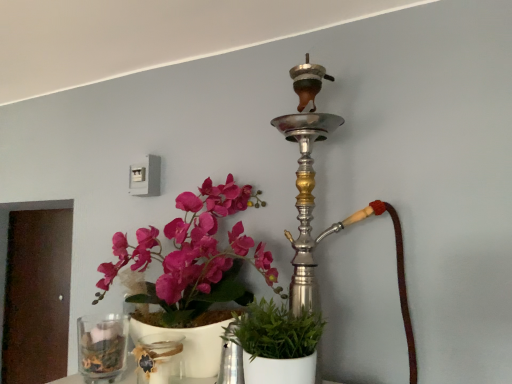
Describe the element at coordinates (276, 343) in the screenshot. Image resolution: width=512 pixels, height=384 pixels. I see `green matte plant at center` at that location.

The width and height of the screenshot is (512, 384). What do you see at coordinates (158, 358) in the screenshot?
I see `transparent glass jar at lower center` at bounding box center [158, 358].

This screenshot has width=512, height=384. What do you see at coordinates (314, 202) in the screenshot? I see `silver metallic hookah at upper center` at bounding box center [314, 202].

Identify the location of green matte plant at center. Image resolution: width=512 pixels, height=384 pixels. (276, 343).

From a real-world perspective, who is located lower, clear glass vase at lower left or silver metallic hookah at upper center?

clear glass vase at lower left.

Is the depth of clear glass vase at lower left greater than that of silver metallic hookah at upper center?

That is True.

Is clear glass vase at lower left looking in the opposite direction of silver metallic hookah at upper center?

clear glass vase at lower left is not turned away from silver metallic hookah at upper center.

Can you tell me how much clear glass vase at lower left and silver metallic hookah at upper center differ in facing direction?

They differ by 0.000799 degrees in their facing directions.

Where is `glass vase lying behind the silver metallic hookah at upper center`? This screenshot has width=512, height=384. glass vase lying behind the silver metallic hookah at upper center is located at coordinates (158, 358).

Is transparent glass jar at lower center in contact with silver metallic hookah at upper center?

They are not placed beside each other.

From a real-world perspective, which is physically below, transparent glass jar at lower center or silver metallic hookah at upper center?

From a 3D spatial view, transparent glass jar at lower center is below.

Which is correct: transparent glass jar at lower center is inside silver metallic hookah at upper center, or outside of it?

transparent glass jar at lower center is located beyond the bounds of silver metallic hookah at upper center.

Which of these two, silver metallic hookah at upper center or green matte plant at center, stands shorter?

green matte plant at center is shorter.

Considering the points (301, 252) and (255, 314), which point is behind, point (301, 252) or point (255, 314)?

Point (301, 252)

Is silver metallic hookah at upper center inside or outside of green matte plant at center?

silver metallic hookah at upper center is located beyond the bounds of green matte plant at center.

Could you tell me if silver metallic hookah at upper center is turned towards green matte plant at center?

Yes, silver metallic hookah at upper center faces towards green matte plant at center.

Which of these two, transparent glass jar at lower center or green matte plant at center, is smaller?

With smaller size is transparent glass jar at lower center.

Considering the points (161, 359) and (293, 379), which point is in front, point (161, 359) or point (293, 379)?

The point (293, 379) is in front.

Do you think transparent glass jar at lower center is within green matte plant at center, or outside of it?

transparent glass jar at lower center is spatially situated outside green matte plant at center.

How far apart are transparent glass jar at lower center and green matte plant at center?

transparent glass jar at lower center is 10.18 inches from green matte plant at center.

Identify the location of vase on the left of transparent glass jar at lower center. The image size is (512, 384). (102, 347).

Between point (79, 351) and point (140, 354), which one is positioned in front?

Positioned in front is point (140, 354).

Does clear glass vase at lower left have a lesser width compared to transparent glass jar at lower center?

Correct, the width of clear glass vase at lower left is less than that of transparent glass jar at lower center.

Is point (394, 214) behind point (118, 315)?

No, it is in front of (118, 315).

From a real-world perspective, is silver metallic hookah at upper center on clear glass vase at lower left?

Yes.

From the image's perspective, relative to clear glass vase at lower left, is silver metallic hookah at upper center above or below?

silver metallic hookah at upper center is situated higher than clear glass vase at lower left in the image.

Consider the image. From the image's perspective, is transparent glass jar at lower center located above clear glass vase at lower left?

Actually, transparent glass jar at lower center appears below clear glass vase at lower left in the image.

Considering the sizes of objects transparent glass jar at lower center and clear glass vase at lower left in the image provided, who is taller, transparent glass jar at lower center or clear glass vase at lower left?

clear glass vase at lower left.

From a real-world perspective, is transparent glass jar at lower center located beneath clear glass vase at lower left?

Yes, from a real-world perspective, transparent glass jar at lower center is beneath clear glass vase at lower left.

Locate an element on the screen. The width and height of the screenshot is (512, 384). candle holder above the clear glass vase at lower left (from the image's perspective) is located at coordinates (314, 202).

You are a GUI agent. You are given a task and a screenshot of the screen. Output one action in this format:
    pyautogui.click(x=<x>, y=<y>)
    Task: Click on the candle holder that is in front of the transparent glass jar at lower center
    
    Given the screenshot: What is the action you would take?
    pyautogui.click(x=314, y=202)

Which object lies further to the anchor point silver metallic hookah at upper center, green matte plant at center or transparent glass jar at lower center?

The object further to silver metallic hookah at upper center is transparent glass jar at lower center.

From the image, which object appears to be farther from clear glass vase at lower left, transparent glass jar at lower center or green matte plant at center?

Among the two, green matte plant at center is located further to clear glass vase at lower left.

From the image, which object appears to be farther from silver metallic hookah at upper center, transparent glass jar at lower center or green matte plant at center?

transparent glass jar at lower center.

Based on their spatial positions, is green matte plant at center or clear glass vase at lower left closer to transparent glass jar at lower center?

clear glass vase at lower left.

Based on their spatial positions, is silver metallic hookah at upper center or transparent glass jar at lower center further from clear glass vase at lower left?

silver metallic hookah at upper center.

Estimate the real-world distances between objects in this image. Which object is further from transparent glass jar at lower center, green matte plant at center or silver metallic hookah at upper center?

silver metallic hookah at upper center is further to transparent glass jar at lower center.

Considering their positions, is silver metallic hookah at upper center positioned further to transparent glass jar at lower center than green matte plant at center?

Based on the image, silver metallic hookah at upper center appears to be further to transparent glass jar at lower center.

Based on their spatial positions, is silver metallic hookah at upper center or clear glass vase at lower left further from transparent glass jar at lower center?

silver metallic hookah at upper center is further to transparent glass jar at lower center.

Locate an element on the screen. houseplant between transparent glass jar at lower center and silver metallic hookah at upper center from left to right is located at coordinates (276, 343).

Find the location of a particular element. glass vase between clear glass vase at lower left and green matte plant at center in the horizontal direction is located at coordinates (158, 358).

Where is `houseplant between clear glass vase at lower left and silver metallic hookah at upper center in the horizontal direction`? The image size is (512, 384). houseplant between clear glass vase at lower left and silver metallic hookah at upper center in the horizontal direction is located at coordinates (276, 343).

Where is `glass vase located between clear glass vase at lower left and silver metallic hookah at upper center in the left-right direction`? glass vase located between clear glass vase at lower left and silver metallic hookah at upper center in the left-right direction is located at coordinates (158, 358).